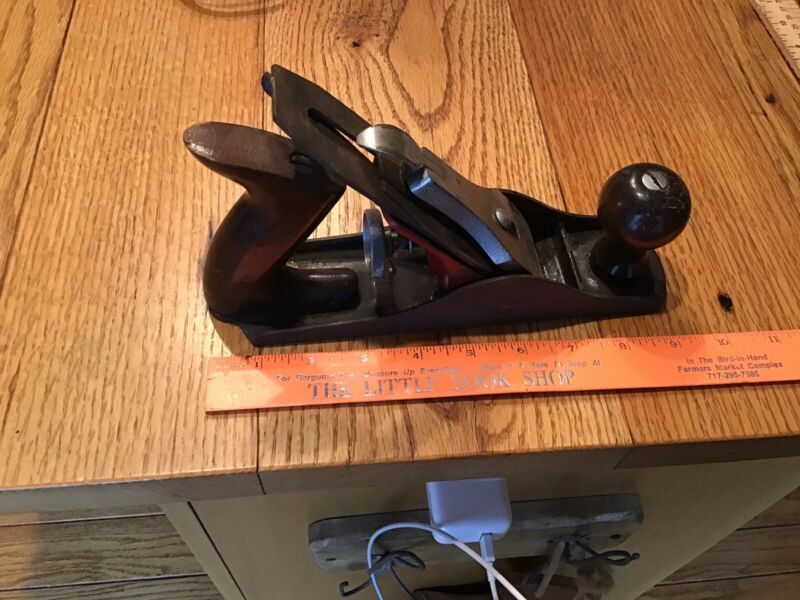
What are the coordinates of `table` in the screenshot? It's located at (94, 242).